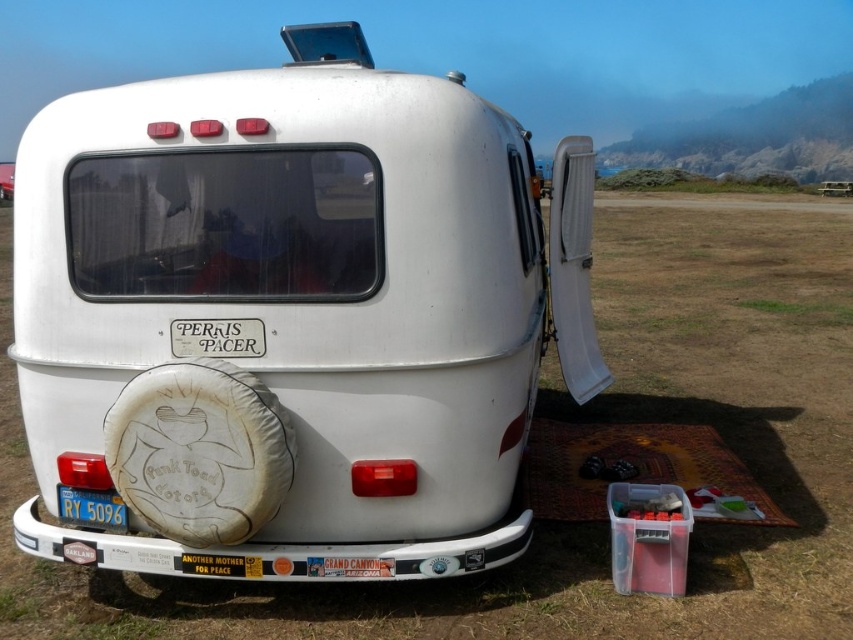
You are a delivery person trying to secure a package on the roof of the trailer. You need to know if the white fabric tire at rear will block access to the blue metallic license plate at lower left. Can you confirm?

The white fabric tire at rear is positioned over the blue metallic license plate at lower left, so it will block access to the blue metallic license plate at lower left.

You are a delivery person trying to secure a package to the back of the trailer. You have a strap that can only fit around items wider than the blue metallic license plate at lower left. Can you use the strap around the white fabric tire at rear?

The white fabric tire at rear is wider than the blue metallic license plate at lower left, so the strap can be used around the white fabric tire at rear since it meets the width requirement.